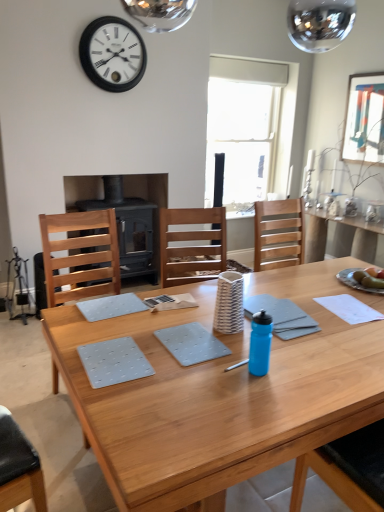
You are a GUI agent. You are given a task and a screenshot of the screen. Output one action in this format:
    pyautogui.click(x=<x>, y=<y>)
    Task: Click on the free space in front of gray matte notebook at center
    
    Given the screenshot: What is the action you would take?
    309,350